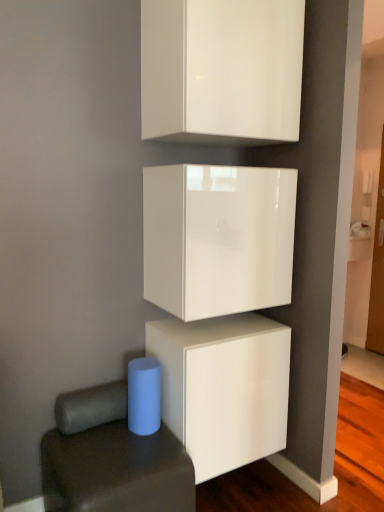
Identify the location of vacant space in glossy white cube at center, the second cabinetry when ordered from bottom to top (from a real-world perspective). The image size is (384, 512). (211, 325).